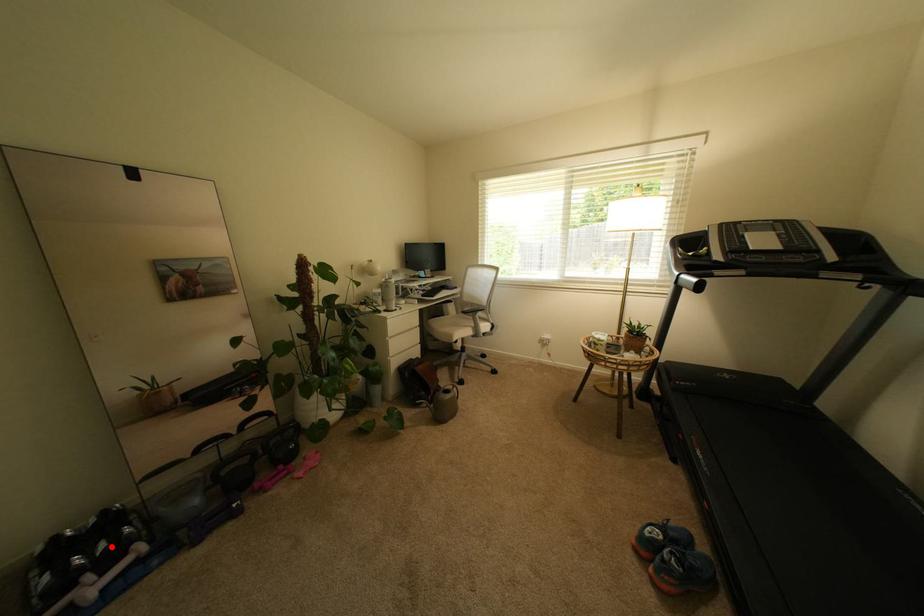
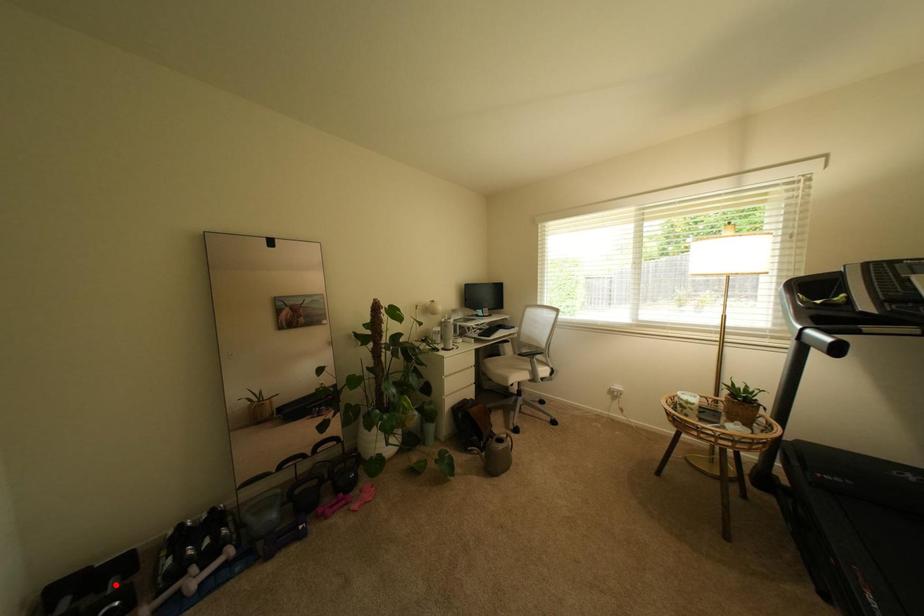
I am providing you with two images of the same scene from different viewpoints. A red point is marked on the first image and another point is marked on the second image. Are the points marked in image1 and image2 representing the same 3D position?

No